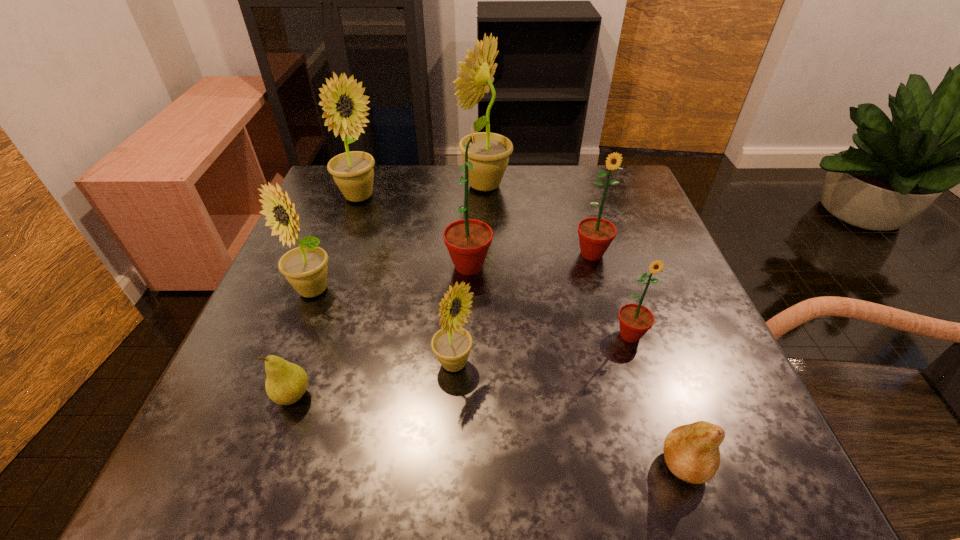
At what (x,y) coordinates should I click in order to perform the action: click on free space at the right edge of the desktop. Please return your answer as a coordinate pair (x, y). The height and width of the screenshot is (540, 960). Looking at the image, I should click on (664, 292).

In the image, there is a desktop. Identify the location of vacant area at the far right corner. (x=634, y=173).

Find the location of `vacant space at the near right corner of the desktop`. vacant space at the near right corner of the desktop is located at coordinates pos(771,489).

Where is `empty space between the third farthest yellow sunflower and the biggest yellow sunflower`? empty space between the third farthest yellow sunflower and the biggest yellow sunflower is located at coordinates (398, 238).

Identify the location of unoccupied area between the second biggest yellow sunflower and the smallest green sunflower. Image resolution: width=960 pixels, height=540 pixels. pyautogui.click(x=494, y=266).

At what (x,y) coordinates should I click in order to perform the action: click on vacant region between the nearest object and the leftmost green sunflower. Please return your answer as a coordinate pair (x, y). Looking at the image, I should click on (576, 366).

The image size is (960, 540). I want to click on vacant space that is in between the nearest green sunflower and the second smallest green sunflower, so click(x=611, y=295).

Find the location of a particular element. The width and height of the screenshot is (960, 540). unoccupied position between the leftmost green sunflower and the nearest green sunflower is located at coordinates (549, 301).

Find the location of `free space between the left pear and the second smallest yellow sunflower`. free space between the left pear and the second smallest yellow sunflower is located at coordinates (302, 343).

At what (x,y) coordinates should I click in order to perform the action: click on free space that is in between the second biggest yellow sunflower and the biggest yellow sunflower. Please return your answer as a coordinate pair (x, y). Looking at the image, I should click on pyautogui.click(x=421, y=191).